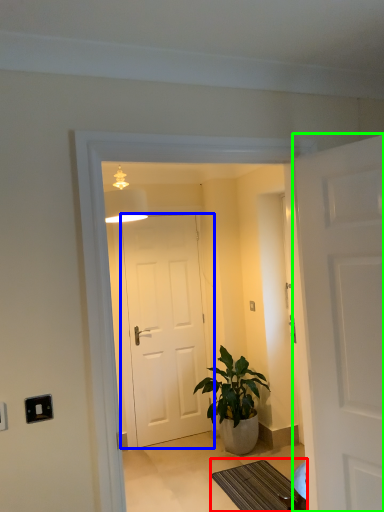
Question: Based on their relative distances, which object is farther from doormat (highlighted by a red box)? Choose from door (highlighted by a blue box) and door (highlighted by a green box).

Choices:
 (A) door
 (B) door

Answer: (B)